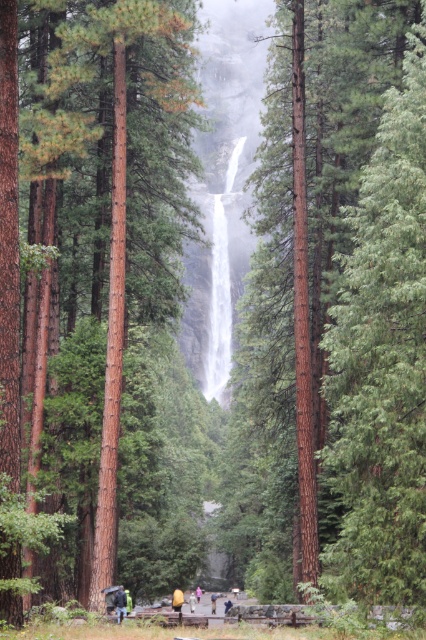
Question: Among these points, which one is nearest to the camera?

Choices:
 (A) (236, 372)
 (B) (118, 614)
 (C) (175, 596)
 (D) (135, 445)

Answer: (B)

Question: In this image, where is green rough bark tree at center located relative to smooth brown tree trunk at center?

Choices:
 (A) left
 (B) right

Answer: (B)

Question: Among these objects, which one is nearest to the camera?

Choices:
 (A) green rough bark tree at center
 (B) yellow fabric person at center
 (C) dark blue jeans at center
 (D) smooth brown tree trunk at center

Answer: (D)

Question: Does green rough bark tree at center lie in front of dark blue jeans at center?

Choices:
 (A) no
 (B) yes

Answer: (B)

Question: Is dark blue jeans at center positioned behind yellow fabric person at center?

Choices:
 (A) no
 (B) yes

Answer: (A)

Question: Which object is the closest to the green rough bark tree at center?

Choices:
 (A) yellow fabric person at center
 (B) smooth brown tree trunk at center
 (C) dark blue jeans at center

Answer: (B)